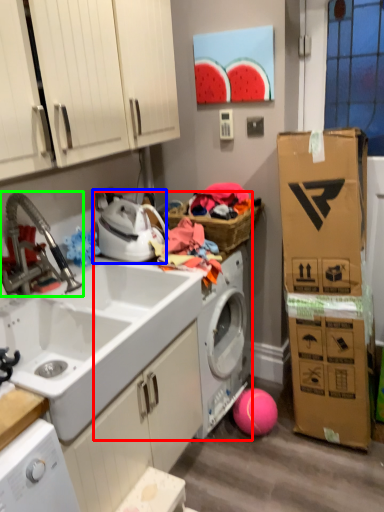
Question: Which object is positioned farthest from washing machine (highlighted by a red box)? Select from appliance (highlighted by a blue box) and faucet (highlighted by a green box).

Choices:
 (A) appliance
 (B) faucet

Answer: (B)